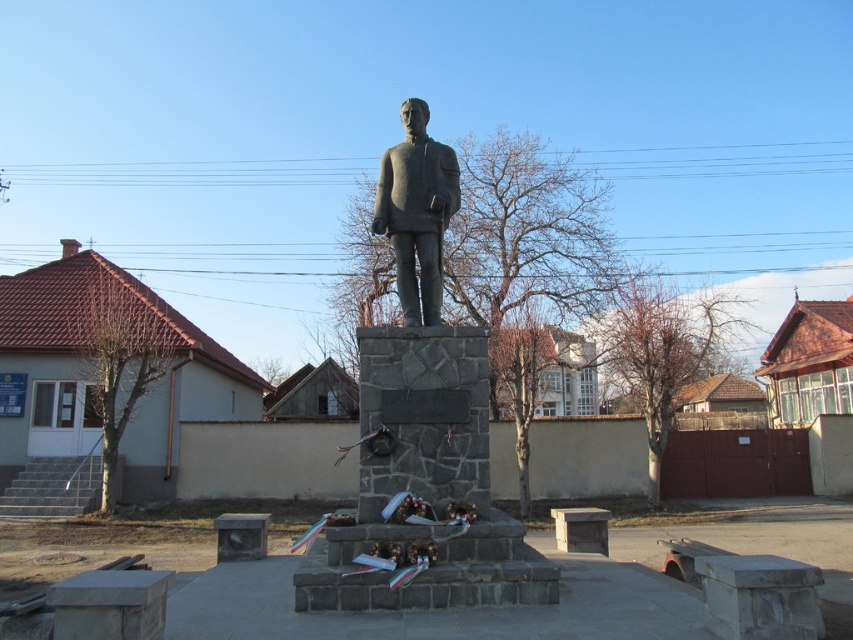
Question: Can you confirm if polished bronze statue at center is positioned to the left of bronze statue at center?

Choices:
 (A) no
 (B) yes

Answer: (A)

Question: Does polished bronze statue at center have a larger size compared to bronze statue at center?

Choices:
 (A) yes
 (B) no

Answer: (A)

Question: Does polished bronze statue at center come in front of bronze statue at center?

Choices:
 (A) no
 (B) yes

Answer: (B)

Question: Which of the following is the farthest from the observer?

Choices:
 (A) polished bronze statue at center
 (B) bronze statue at center

Answer: (B)

Question: Among these objects, which one is nearest to the camera?

Choices:
 (A) bronze statue at center
 (B) polished bronze statue at center

Answer: (B)